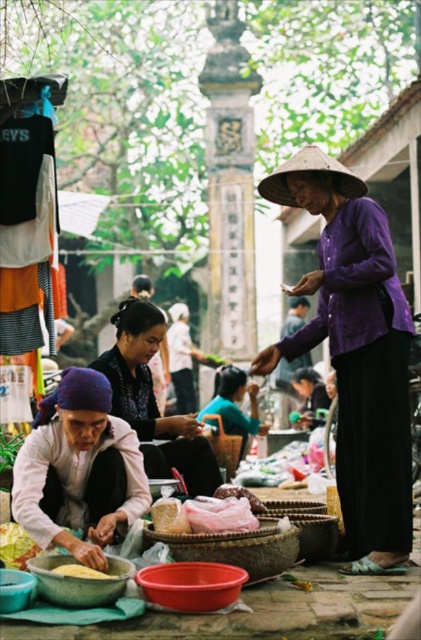
Is white fabric headscarf at center taller than matte purple blouse at center?

Indeed, white fabric headscarf at center has a greater height compared to matte purple blouse at center.

Which of these two, white fabric headscarf at center or matte purple blouse at center, stands shorter?

matte purple blouse at center

Between point (135, 301) and point (256, 403), which one is positioned behind?

Point (256, 403)

I want to click on white fabric headscarf at center, so click(154, 401).

Which is in front, point (125, 410) or point (106, 577)?

Point (106, 577) is more forward.

What do you see at coordinates (154, 401) in the screenshot?
I see `white fabric headscarf at center` at bounding box center [154, 401].

Is point (188, 452) positioned before point (68, 568)?

No, it is not.

Find the location of `white fabric headscarf at center`. white fabric headscarf at center is located at coordinates (154, 401).

Does purple matte hat at upper right have a lesser height compared to matte purple blouse at center?

No.

Is purple matte hat at upper right to the right of matte purple blouse at center from the viewer's perspective?

Indeed, purple matte hat at upper right is positioned on the right side of matte purple blouse at center.

Is point (359, 189) farther from camera compared to point (216, 385)?

No, (359, 189) is closer to viewer.

Where is `purple matte hat at upper right`? The width and height of the screenshot is (421, 640). purple matte hat at upper right is located at coordinates (356, 353).